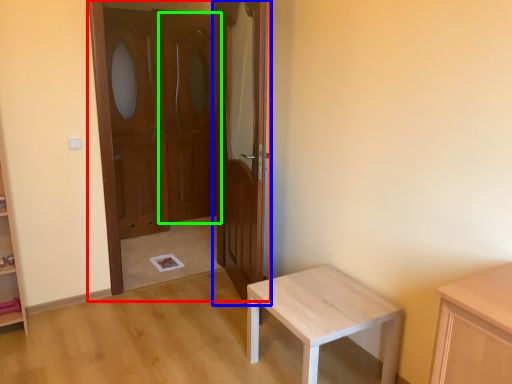
Question: Which is farther away from door (highlighted by a red box)? door (highlighted by a blue box) or screen door (highlighted by a green box)?

Choices:
 (A) door
 (B) screen door

Answer: (A)